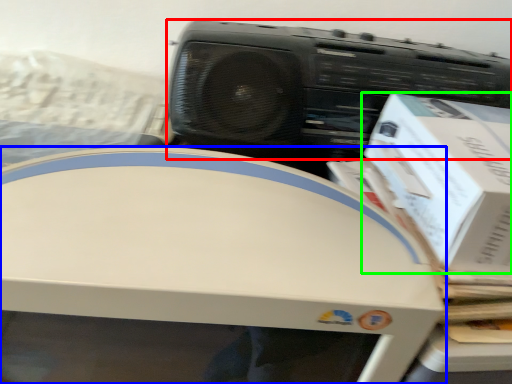
Question: Which is farther away from cassette (highlighted by a red box)? home appliance (highlighted by a blue box) or box (highlighted by a green box)?

Choices:
 (A) home appliance
 (B) box

Answer: (A)